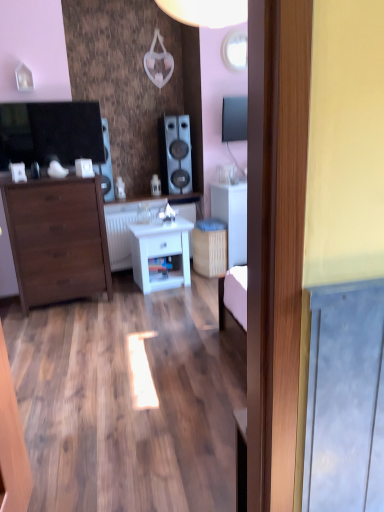
Question: Considering the relative sizes of white matte cabinet at center and satin black speaker at center, the 2th speaker when ordered from left to right, in the image provided, is white matte cabinet at center shorter than satin black speaker at center, the 2th speaker when ordered from left to right,?

Choices:
 (A) yes
 (B) no

Answer: (B)

Question: Is white matte cabinet at center directly adjacent to satin black speaker at center, arranged as the 1th speaker when viewed from the right?

Choices:
 (A) yes
 (B) no

Answer: (B)

Question: Is the position of white matte cabinet at center more distant than that of satin black speaker at center, arranged as the 1th speaker when viewed from the right?

Choices:
 (A) yes
 (B) no

Answer: (B)

Question: From the image's perspective, would you say white matte cabinet at center is positioned over satin black speaker at center, arranged as the 1th speaker when viewed from the right?

Choices:
 (A) yes
 (B) no

Answer: (B)

Question: Can we say white matte cabinet at center lies outside satin black speaker at center, arranged as the 1th speaker when viewed from the right?

Choices:
 (A) yes
 (B) no

Answer: (A)

Question: Considering the relative positions of white glossy nightstand at center and white glossy counter top at center, which is counted as the 1th counter top, starting from the bottom, in the image provided, is white glossy nightstand at center to the left or to the right of white glossy counter top at center, which is counted as the 1th counter top, starting from the bottom,?

Choices:
 (A) left
 (B) right

Answer: (B)

Question: In terms of height, does white glossy nightstand at center look taller or shorter compared to white glossy counter top at center, which is the 2th counter top in top-to-bottom order?

Choices:
 (A) short
 (B) tall

Answer: (A)

Question: Choose the correct answer: Is white glossy nightstand at center inside white glossy counter top at center, which is the 2th counter top in top-to-bottom order, or outside it?

Choices:
 (A) outside
 (B) inside

Answer: (A)

Question: Considering the positions of point (135, 252) and point (125, 202), is point (135, 252) closer or farther from the camera than point (125, 202)?

Choices:
 (A) closer
 (B) farther

Answer: (A)

Question: Is point tap(99, 164) positioned closer to the camera than point tap(183, 282)?

Choices:
 (A) closer
 (B) farther

Answer: (A)

Question: Looking at the image, does matte black speaker at left, which appears as the first speaker when viewed from the left, seem bigger or smaller compared to white glossy nightstand at center?

Choices:
 (A) small
 (B) big

Answer: (A)

Question: From a real-world perspective, relative to white glossy nightstand at center, is matte black speaker at left, positioned as the second speaker in right-to-left order, vertically above or below?

Choices:
 (A) below
 (B) above

Answer: (B)

Question: In the image, is matte black speaker at left, which appears as the first speaker when viewed from the left, positioned in front of or behind white glossy nightstand at center?

Choices:
 (A) behind
 (B) front

Answer: (A)

Question: Considering their positions, is matte brown chest of drawers at left located in front of or behind white matte cabinet at center?

Choices:
 (A) front
 (B) behind

Answer: (A)

Question: Does point (36, 276) appear closer or farther from the camera than point (241, 214)?

Choices:
 (A) closer
 (B) farther

Answer: (A)